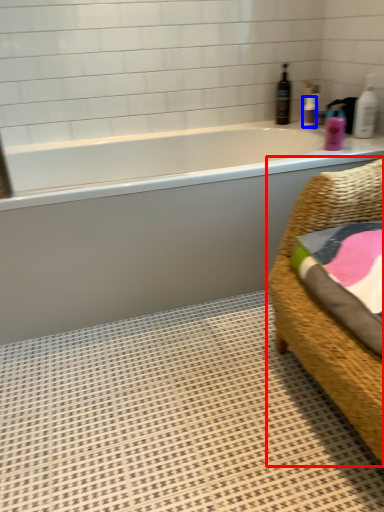
Question: Which object appears farthest to the camera in this image, furniture (highlighted by a red box) or toiletry (highlighted by a blue box)?

Choices:
 (A) furniture
 (B) toiletry

Answer: (B)